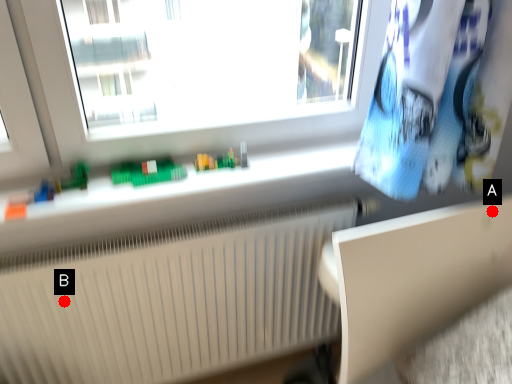
Question: Two points are circled on the image, labeled by A and B beside each circle. Which point is farther from the camera taking this photo?

Choices:
 (A) A is further
 (B) B is further

Answer: (B)